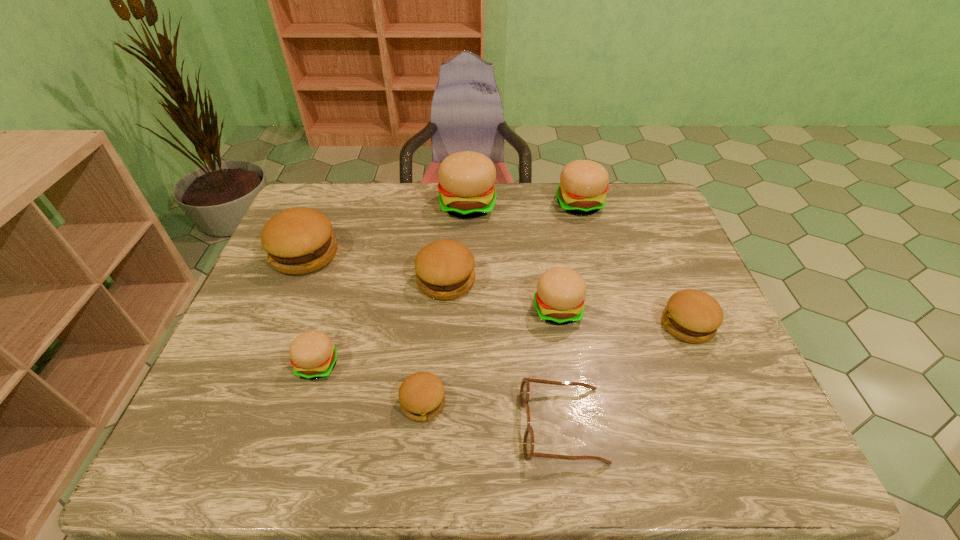
Identify the location of vacant area situated on the left of the shortest hamburger. (332, 402).

At what (x,y) coordinates should I click in order to perform the action: click on vacant space positioned on the front-facing side of the spectacles. Please return your answer as a coordinate pair (x, y). Looking at the image, I should click on (449, 425).

Image resolution: width=960 pixels, height=540 pixels. Find the location of `blank space located 0.120m on the front-facing side of the spectacles`. blank space located 0.120m on the front-facing side of the spectacles is located at coordinates (464, 425).

Identify the location of free space located on the front-facing side of the spectacles. (420, 425).

Where is `object at the near edge`? The image size is (960, 540). object at the near edge is located at coordinates (528, 441).

Where is `object positioned at the left edge`? object positioned at the left edge is located at coordinates [x=298, y=241].

Locate an element on the screen. The width and height of the screenshot is (960, 540). object at the right edge is located at coordinates (693, 316).

This screenshot has width=960, height=540. In the image, there is a desktop. Find the location of `vacant space at the far edge`. vacant space at the far edge is located at coordinates (391, 208).

The width and height of the screenshot is (960, 540). What are the coordinates of `free region at the near edge of the desktop` in the screenshot? It's located at (448, 429).

Where is `free space at the left edge of the desktop`? Image resolution: width=960 pixels, height=540 pixels. free space at the left edge of the desktop is located at coordinates (276, 337).